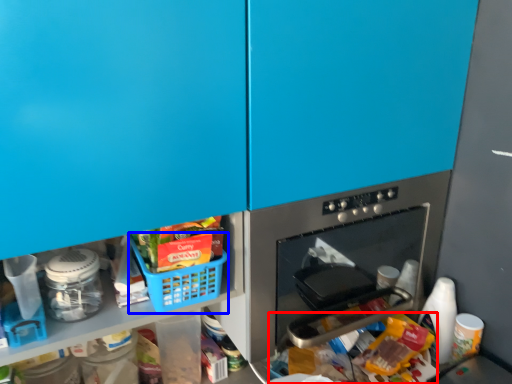
Question: Which of the following is the farthest to the observer, food (highlighted by a red box) or basket (highlighted by a blue box)?

Choices:
 (A) food
 (B) basket

Answer: (B)